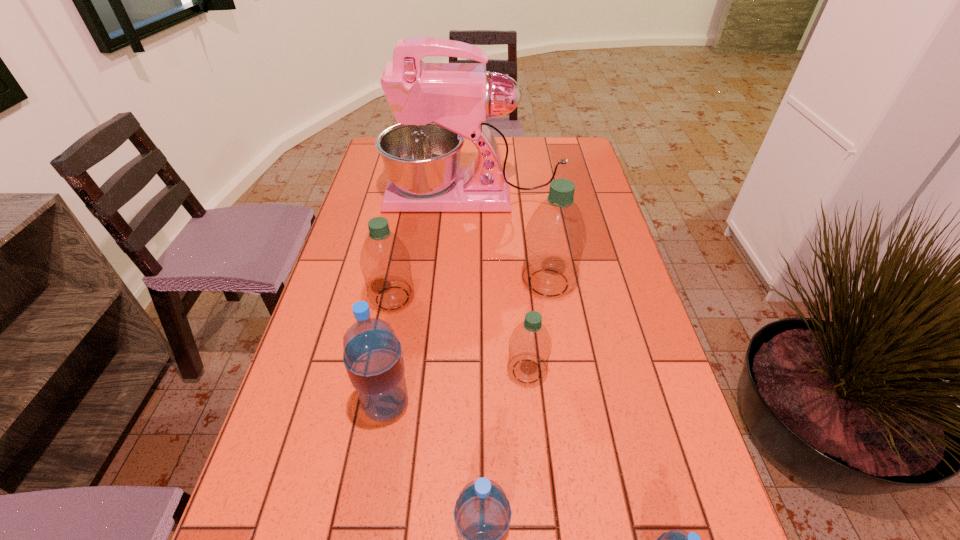
In order to click on vacant region located 0.270m on the front of the nearest green water bottle in this screenshot , I will do `click(541, 529)`.

The height and width of the screenshot is (540, 960). I want to click on mixer that is at the left edge, so click(x=436, y=105).

This screenshot has width=960, height=540. Identify the location of mixer that is at the right edge. (436, 105).

The width and height of the screenshot is (960, 540). I want to click on water bottle at the right edge, so click(x=555, y=237).

This screenshot has width=960, height=540. I want to click on vacant area at the far edge of the desktop, so click(506, 164).

Identify the location of free spot at the left edge of the desktop. (282, 431).

The image size is (960, 540). Identify the location of vacant position at the right edge of the desktop. (587, 213).

Where is `vacant area at the far right corner of the desktop`? The height and width of the screenshot is (540, 960). vacant area at the far right corner of the desktop is located at coordinates (552, 155).

Find the location of a particular element. free space between the nearest green water bottle and the mixer is located at coordinates (500, 284).

Identify which object is the closest to the farthest object. Please provide its 2D coordinates. Your answer should be formatted as a tuple, i.e. [(x, y)], where the tuple contains the x and y coordinates of a point satisfying the conditions above.

[(555, 237)]